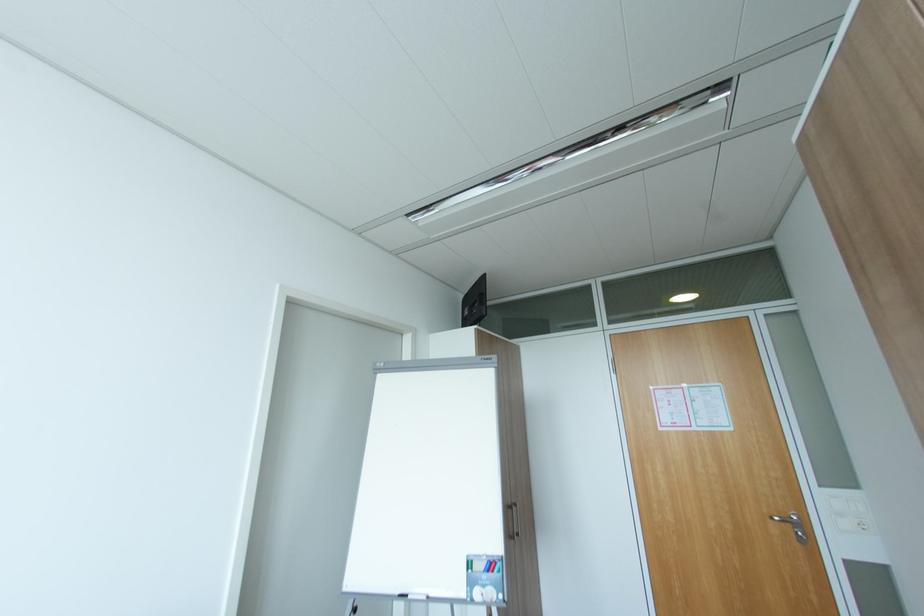
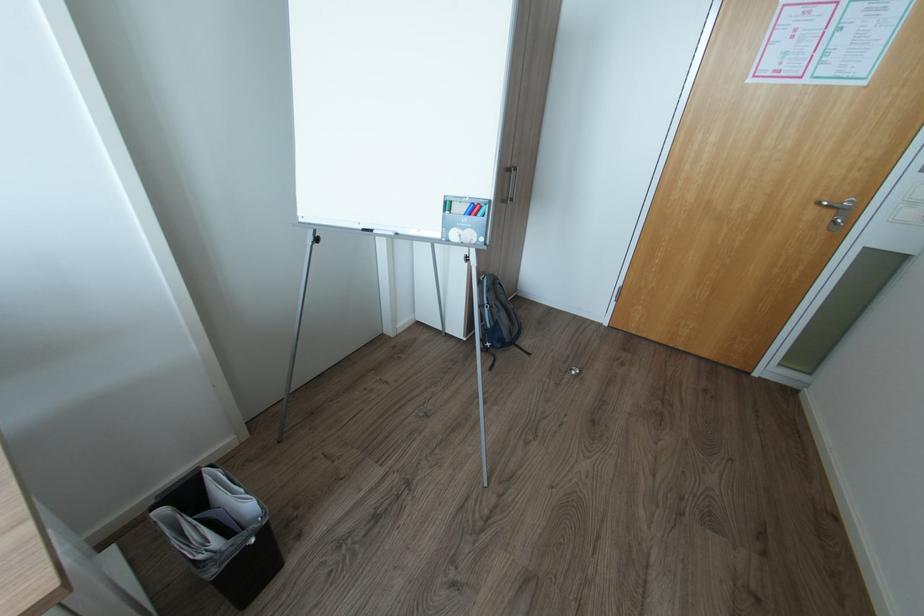
Where in the second image is the point corresponding to point (515, 503) from the first image?

(514, 166)